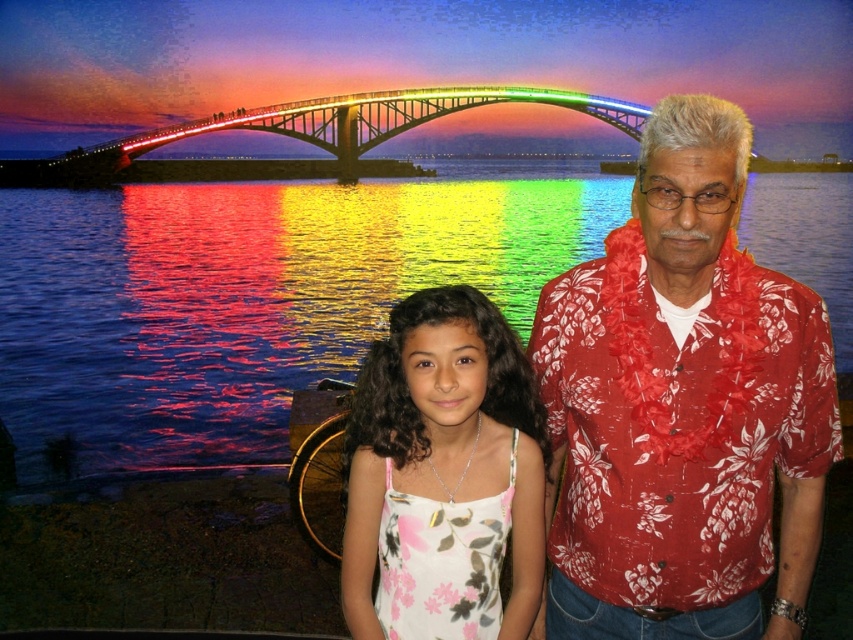
You are standing on the bridge and want to walk towards the point labeled point [202,316]. Which direction should you face if you are currently facing the point labeled point [366,529]?

Since point [202,316] is behind point [366,529], you should turn around to face the opposite direction to walk towards point [202,316].